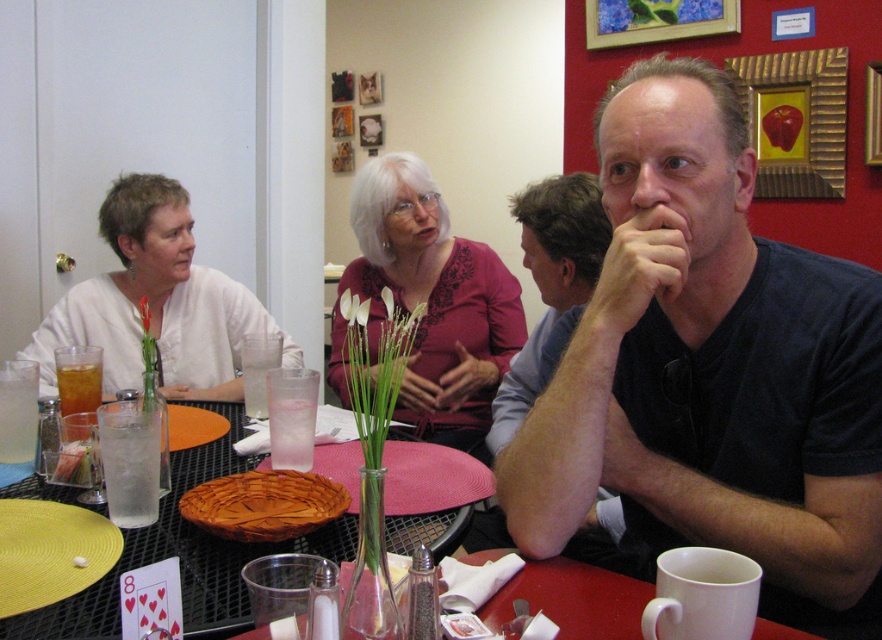
At what (x,y) coordinates should I click in order to perform the action: click on dark blue t-shirt at center. Please return your answer as a coordinate pair (x, y). The height and width of the screenshot is (640, 882). Looking at the image, I should click on (711, 371).

Is dark blue t-shirt at center bigger than matte pink blouse at center?

No, dark blue t-shirt at center is not bigger than matte pink blouse at center.

Locate an element on the screen. The image size is (882, 640). dark blue t-shirt at center is located at coordinates (711, 371).

Does clear glass ice at table left have a lesser width compared to translucent glass beverage at table left?

Yes, clear glass ice at table left is thinner than translucent glass beverage at table left.

Which is in front, point (128, 484) or point (79, 422)?

Positioned in front is point (128, 484).

This screenshot has width=882, height=640. What are the coordinates of `clear glass ice at table left` in the screenshot? It's located at (131, 465).

Can you confirm if matte pink blouse at center is shorter than clear glass ice at table left?

In fact, matte pink blouse at center may be taller than clear glass ice at table left.

Can you confirm if matte pink blouse at center is wider than clear glass ice at table left?

Correct, the width of matte pink blouse at center exceeds that of clear glass ice at table left.

Does point (492, 260) come behind point (154, 502)?

Yes, it is.

Find the location of a particular element. This screenshot has width=882, height=640. matte pink blouse at center is located at coordinates (434, 300).